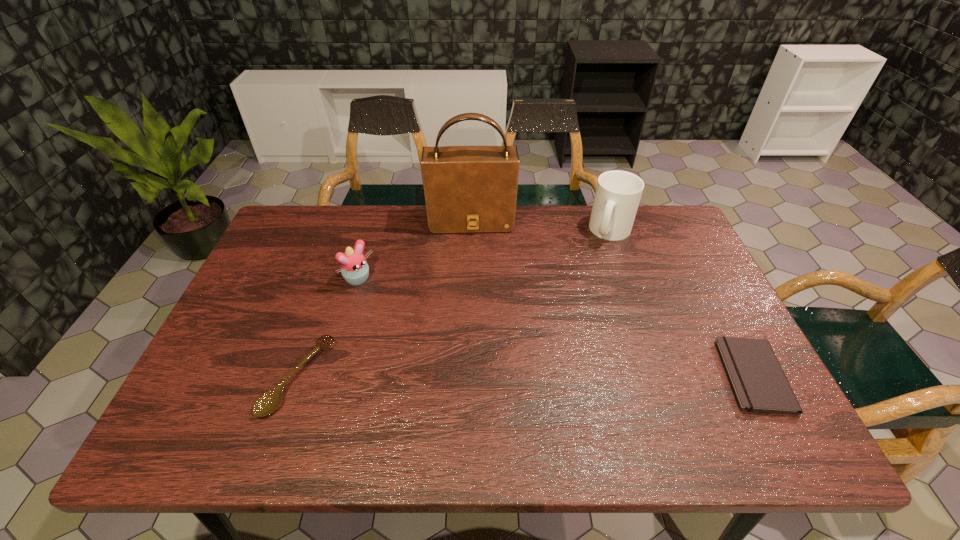
Image resolution: width=960 pixels, height=540 pixels. What are the coordinates of `free space between the fourth object from left to right and the third farthest object` in the screenshot? It's located at (485, 256).

Where is `vacant space in between the shoulder bag and the second object from right to left`? This screenshot has width=960, height=540. vacant space in between the shoulder bag and the second object from right to left is located at coordinates 541,226.

The image size is (960, 540). Find the location of `blank region between the checkbook and the tallest object`. blank region between the checkbook and the tallest object is located at coordinates (612, 298).

What are the coordinates of `empty location between the third tallest object and the tallest object` in the screenshot? It's located at (415, 251).

Locate which object is the third closest to the shoulder bag. Please provide its 2D coordinates. Your answer should be formatted as a tuple, i.e. [(x, y)], where the tuple contains the x and y coordinates of a point satisfying the conditions above.

[(267, 403)]

This screenshot has width=960, height=540. I want to click on object that is the closest to the mug, so click(468, 189).

What are the coordinates of `blank space that satisfies the following two spatial constraints: 1. on the front side of the mug; 2. on the right side of the third object from right to left` in the screenshot? It's located at (471, 231).